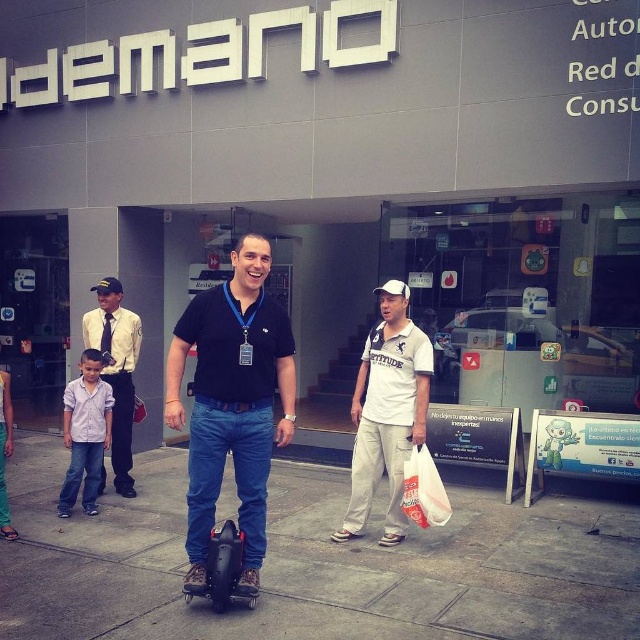
Question: Is matte black scooter at center positioned behind purple cotton shirt at lower left?

Choices:
 (A) yes
 (B) no

Answer: (B)

Question: Which point is farther from the camera taking this photo?

Choices:
 (A) (131, 456)
 (B) (429, 460)
 (C) (378, 605)

Answer: (A)

Question: Among these objects, which one is nearest to the camera?

Choices:
 (A) light brown uniform at left
 (B) matte black scooter at center

Answer: (B)

Question: Where is matte black scooter at center located in relation to purple cotton shirt at lower left in the image?

Choices:
 (A) left
 (B) right

Answer: (B)

Question: Which point is closer to the camera?

Choices:
 (A) (396, 428)
 (B) (109, 301)
 (C) (256, 525)
 (D) (120, 627)

Answer: (D)

Question: Considering the relative positions of light brown uniform at left and purple cotton shirt at lower left in the image provided, where is light brown uniform at left located with respect to purple cotton shirt at lower left?

Choices:
 (A) left
 (B) right

Answer: (B)